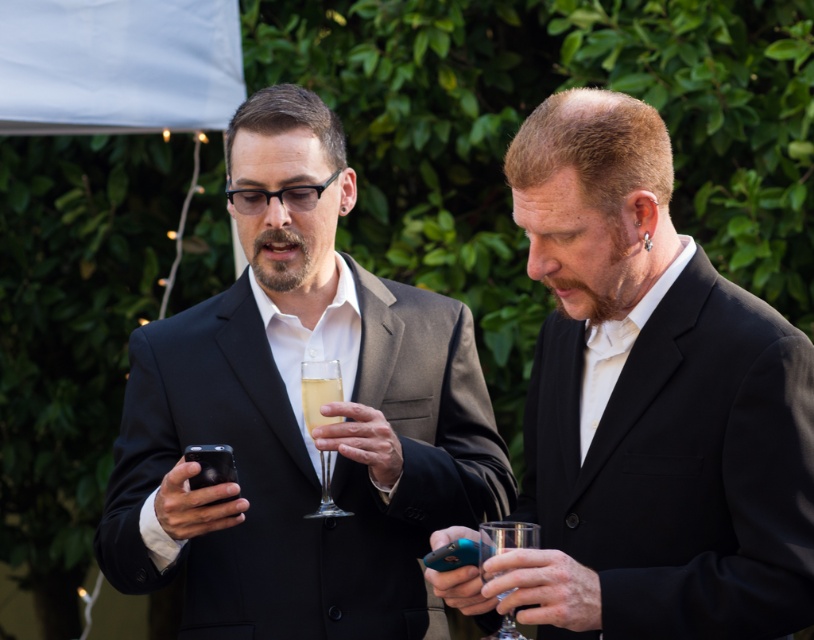
Question: Does matte black suit at right have a lesser width compared to clear glass champagne flute at center?

Choices:
 (A) no
 (B) yes

Answer: (A)

Question: Among these points, which one is nearest to the camera?

Choices:
 (A) (x=493, y=532)
 (B) (x=716, y=310)
 (C) (x=327, y=388)
 (D) (x=294, y=132)

Answer: (A)

Question: Is matte black suit at center wider than matte black suit at right?

Choices:
 (A) no
 (B) yes

Answer: (B)

Question: Based on their relative distances, which object is nearer to the matte black suit at center?

Choices:
 (A) matte black suit at right
 (B) clear crystal wine glass at center

Answer: (B)

Question: Is matte black suit at center positioned behind clear crystal wine glass at center?

Choices:
 (A) no
 (B) yes

Answer: (A)

Question: Estimate the real-world distances between objects in this image. Which object is farther from the clear crystal wine glass at center?

Choices:
 (A) clear glass champagne flute at center
 (B) matte black suit at center
 (C) clear glass wine glass at right

Answer: (C)